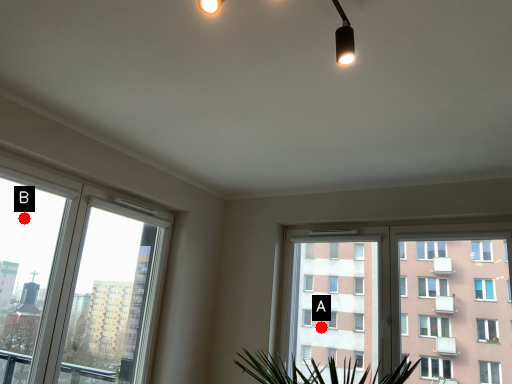
Question: Two points are circled on the image, labeled by A and B beside each circle. Among these points, which one is farthest from the camera?

Choices:
 (A) A is further
 (B) B is further

Answer: (A)